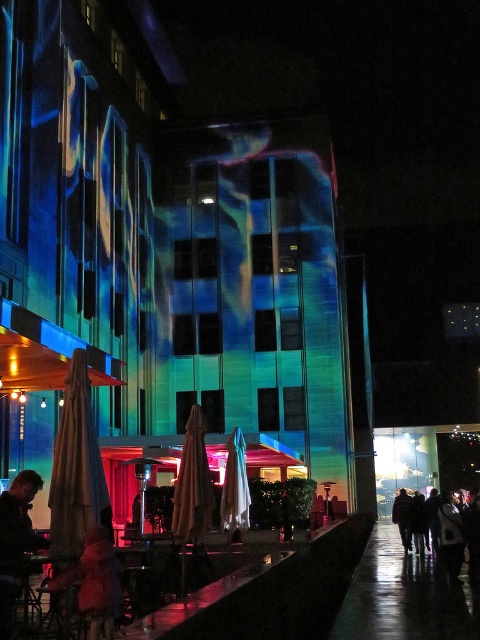
Is leather jacket at lower left positioned before silhouette clothing at lower right?

Yes, leather jacket at lower left is closer to the viewer.

Can you confirm if leather jacket at lower left is positioned to the left of silhouette clothing at lower right?

Correct, you'll find leather jacket at lower left to the left of silhouette clothing at lower right.

Consider the image. Who is more distant from viewer, (0, 493) or (444, 508)?

The point (444, 508) is more distant.

Where is `leather jacket at lower left`? leather jacket at lower left is located at coordinates (15, 540).

Does beige fabric umbrella at center have a larger size compared to leather jacket at lower left?

Yes.

Which is below, beige fabric umbrella at center or leather jacket at lower left?

leather jacket at lower left

The height and width of the screenshot is (640, 480). Identify the location of beige fabric umbrella at center. (192, 490).

Is beige fabric umbrella at center below silhouette clothing at lower right?

No.

In the scene shown: Can you confirm if beige fabric umbrella at center is wider than silhouette clothing at lower right?

No.

Locate an element on the screen. beige fabric umbrella at center is located at coordinates (192, 490).

Where is `beige fabric umbrella at center`? The height and width of the screenshot is (640, 480). beige fabric umbrella at center is located at coordinates [x=192, y=490].